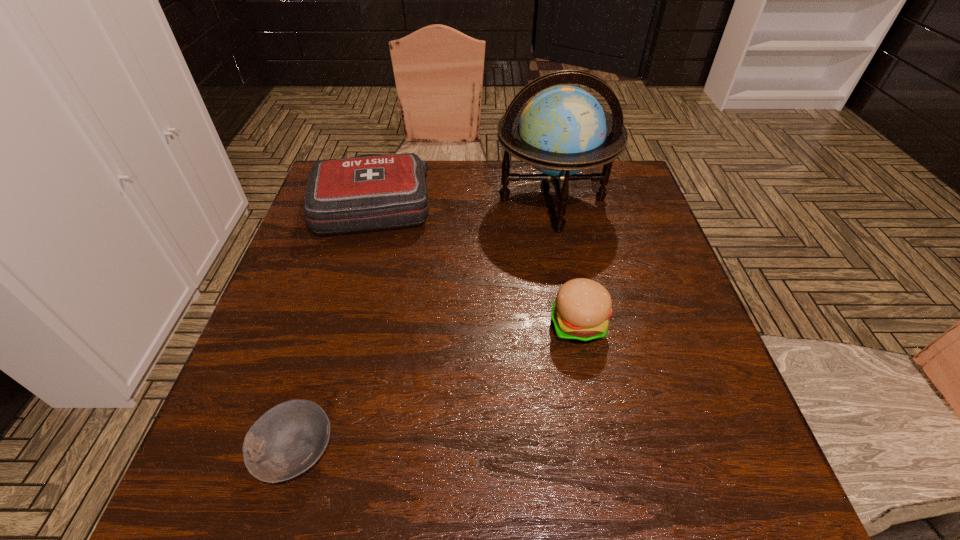
Find the location of a particular element. free point at the left edge is located at coordinates (250, 382).

In the image, there is a desktop. Find the location of `vacant region at the right edge`. vacant region at the right edge is located at coordinates (x=607, y=240).

This screenshot has width=960, height=540. In order to click on vacant space at the near left corner of the desktop in this screenshot , I will do `click(201, 468)`.

Find the location of a particular element. The width and height of the screenshot is (960, 540). vacant space at the far right corner of the desktop is located at coordinates (630, 196).

At what (x,y) coordinates should I click in order to perform the action: click on unoccupied position between the bowl and the hamburger. Please return your answer as a coordinate pair (x, y). The height and width of the screenshot is (540, 960). Looking at the image, I should click on point(437,388).

What are the coordinates of `unoccupied area between the tallest object and the bowl` in the screenshot? It's located at (424, 325).

Identify the location of free spot between the bowl and the first-aid kit. (334, 327).

You are a GUI agent. You are given a task and a screenshot of the screen. Output one action in this format:
    pyautogui.click(x=<x>, y=<y>)
    Task: Click on the unoccupied position between the globe and the shortest object
    This screenshot has width=960, height=540.
    Given the screenshot: What is the action you would take?
    pyautogui.click(x=424, y=325)

This screenshot has height=540, width=960. Find the location of `free space that is in between the second nearest object and the first-aid kit`. free space that is in between the second nearest object and the first-aid kit is located at coordinates (476, 264).

At what (x,y) coordinates should I click in order to perform the action: click on free point between the hamburger and the tallest object. Please return your answer as a coordinate pair (x, y). The image size is (960, 540). Looking at the image, I should click on (565, 262).